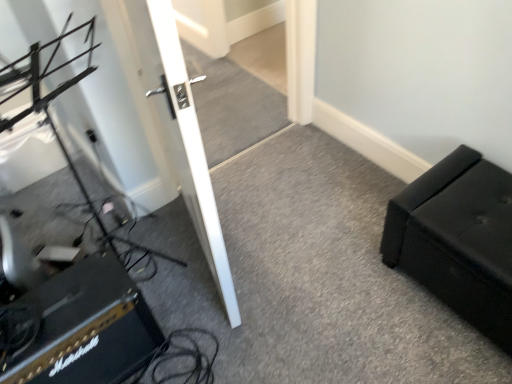
Question: From the image's perspective, is black leather ottoman at right located above black textured amplifier at lower left?

Choices:
 (A) yes
 (B) no

Answer: (A)

Question: From a real-world perspective, is black leather ottoman at right positioned under black textured amplifier at lower left based on gravity?

Choices:
 (A) no
 (B) yes

Answer: (A)

Question: Is black leather ottoman at right looking in the opposite direction of black textured amplifier at lower left?

Choices:
 (A) yes
 (B) no

Answer: (B)

Question: Considering the relative sizes of black leather ottoman at right and black textured amplifier at lower left in the image provided, is black leather ottoman at right smaller than black textured amplifier at lower left?

Choices:
 (A) yes
 (B) no

Answer: (B)

Question: Is the depth of black leather ottoman at right less than that of black textured amplifier at lower left?

Choices:
 (A) no
 (B) yes

Answer: (A)

Question: Would you say black leather ottoman at right is a long distance from black textured amplifier at lower left?

Choices:
 (A) no
 (B) yes

Answer: (B)

Question: Can you confirm if black textured amplifier at lower left is wider than white glossy door at center?

Choices:
 (A) no
 (B) yes

Answer: (B)

Question: From a real-world perspective, is black textured amplifier at lower left positioned over white glossy door at center based on gravity?

Choices:
 (A) yes
 (B) no

Answer: (B)

Question: From the image's perspective, is black textured amplifier at lower left above white glossy door at center?

Choices:
 (A) yes
 (B) no

Answer: (B)

Question: Could you tell me if black textured amplifier at lower left is facing white glossy door at center?

Choices:
 (A) yes
 (B) no

Answer: (B)

Question: Considering the relative sizes of black textured amplifier at lower left and white glossy door at center in the image provided, is black textured amplifier at lower left thinner than white glossy door at center?

Choices:
 (A) yes
 (B) no

Answer: (B)

Question: From a real-world perspective, is black textured amplifier at lower left positioned under white glossy door at center based on gravity?

Choices:
 (A) yes
 (B) no

Answer: (A)

Question: Is white glossy door at center directly adjacent to black textured amplifier at lower left?

Choices:
 (A) yes
 (B) no

Answer: (B)